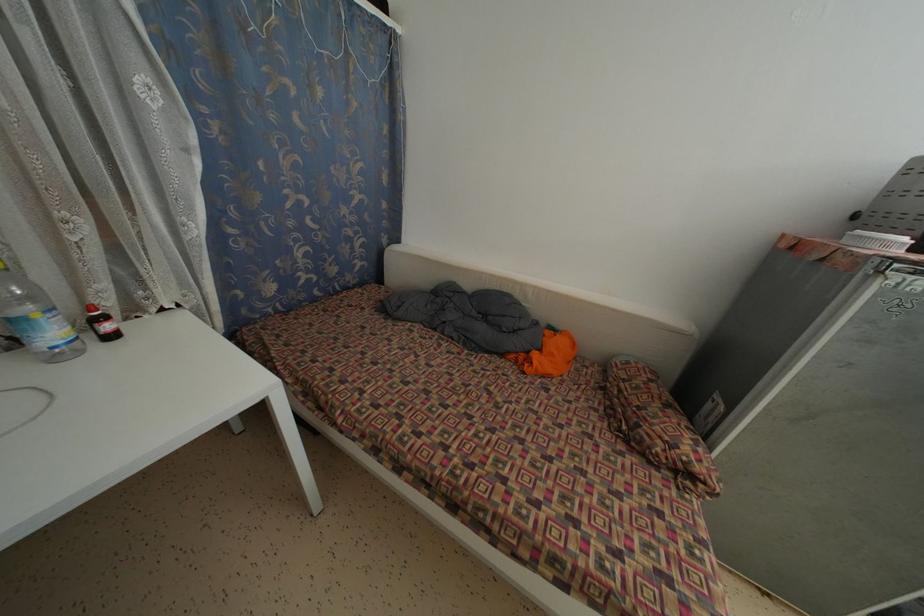
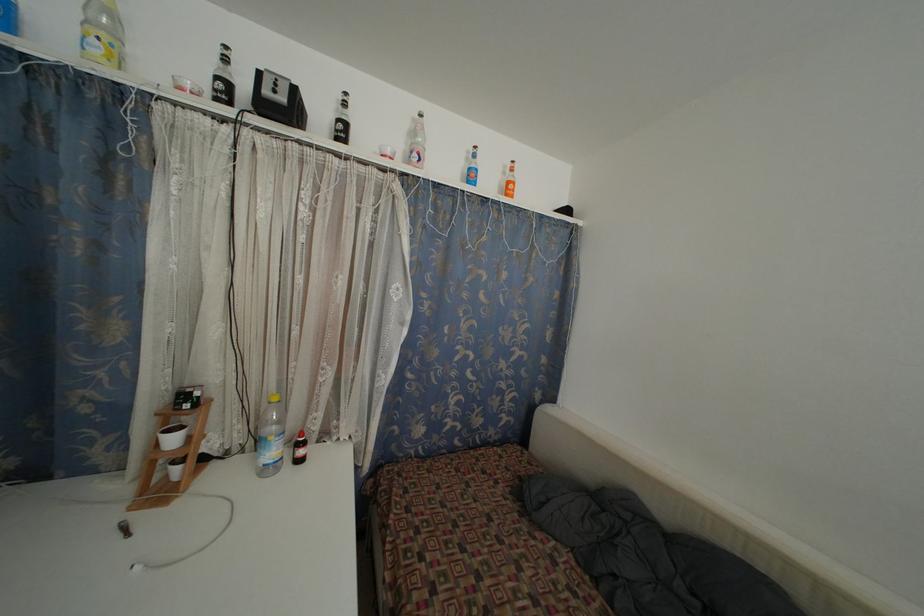
Looking at this image, how did the camera likely rotate?

The camera's rotation is toward left-up.